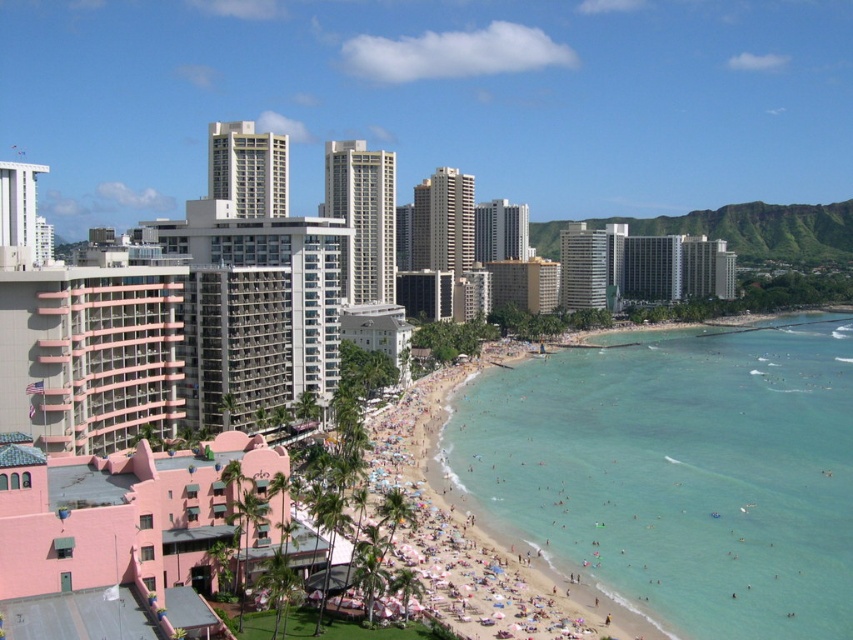
You are standing at the beach and want to take a photo of the iconic pink building. There is a point at coordinates point (498, 596) that is 75.72 meters away from you. Can you estimate if this point is closer to you than the pink building?

The distance of point (498, 596) from viewer is 75.72 meters. Since the iconic pink building is part of the middle ground with high rise buildings, it is likely farther away than 75.72 meters. Therefore, the point is closer to you than the pink building.

You are standing at the beach and looking at the two points marked in the image. Which point, point (229,353) or point (602,632), is closer to you?

Point (229,353) is closer to you because it is further to the camera than point (602,632).

Consider the image. You are standing on the beach sand at center and looking towards the gray concrete building at center. Which direction should you face to see the building?

You should face upwards because the beach sand at center is located below the gray concrete building at center.